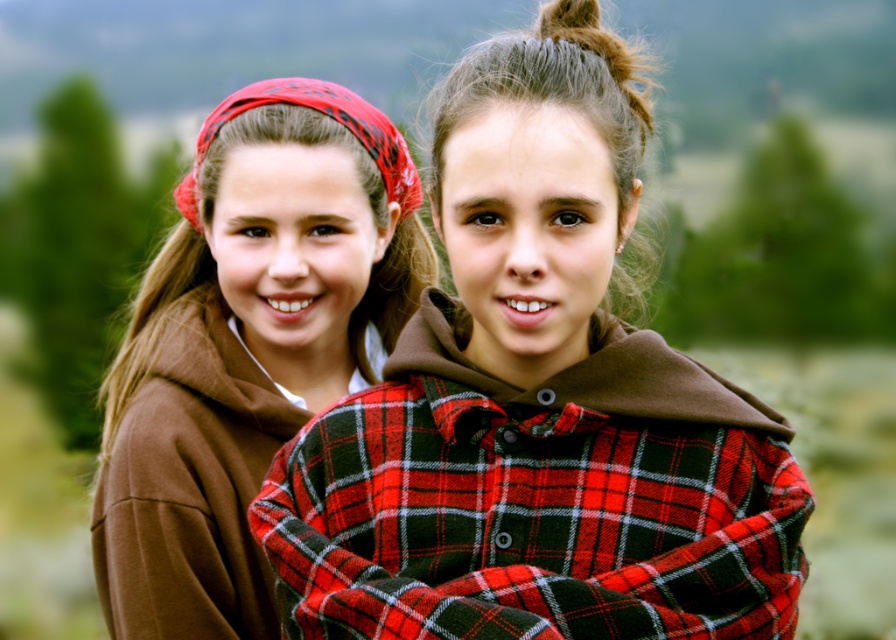
Question: Among these points, which one is farthest from the camera?

Choices:
 (A) (453, 314)
 (B) (190, 506)
 (C) (657, 412)
 (D) (315, 92)

Answer: (D)

Question: Among these objects, which one is farthest from the camera?

Choices:
 (A) matte brown hoodie at left
 (B) matte brown hair at center
 (C) red plaid bandana at upper left
 (D) red plaid shirt at center

Answer: (C)

Question: In this image, where is red plaid shirt at center located relative to matte brown hoodie at left?

Choices:
 (A) left
 (B) right

Answer: (B)

Question: Is red plaid shirt at center further to camera compared to red plaid bandana at upper left?

Choices:
 (A) no
 (B) yes

Answer: (A)

Question: Which point appears farthest from the camera in this image?

Choices:
 (A) (640, 132)
 (B) (489, 410)
 (C) (171, 580)

Answer: (C)

Question: Can you confirm if matte brown hoodie at left is positioned above matte brown hair at center?

Choices:
 (A) no
 (B) yes

Answer: (A)